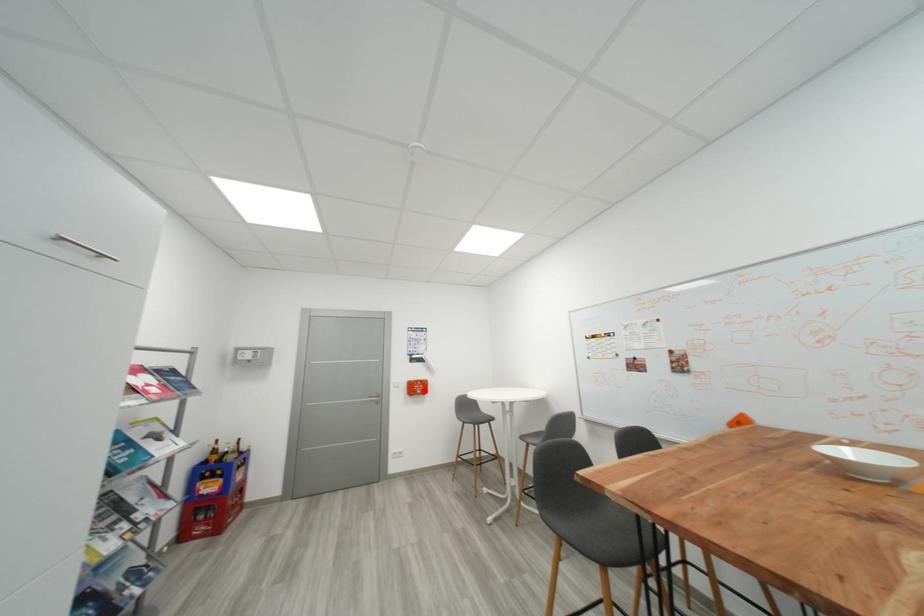
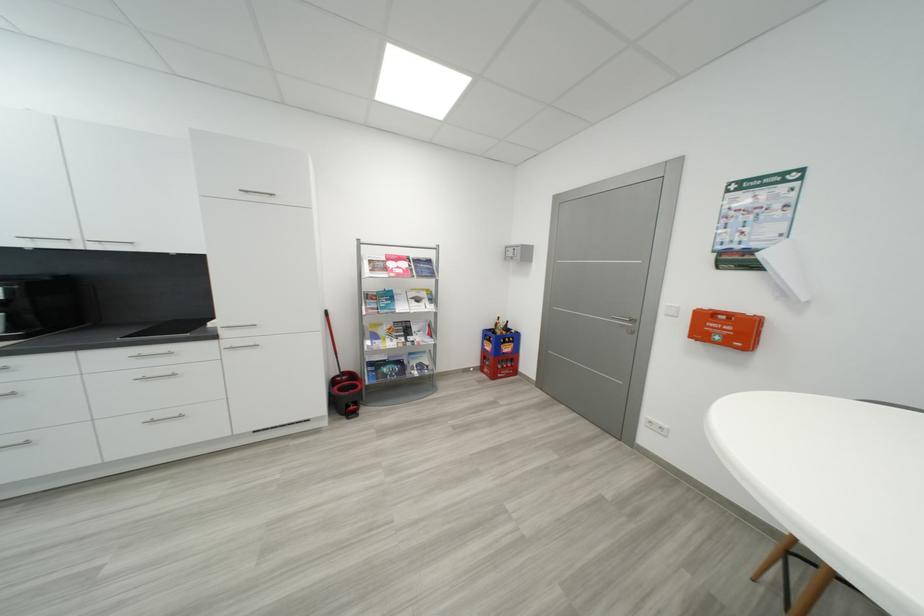
Question: I am providing you with two images of the same scene from different viewpoints. Given a red point in image1, look at the same physical point in image2. Is it:

Choices:
 (A) Closer to the viewpoint
 (B) Farther from the viewpoint

Answer: (A)